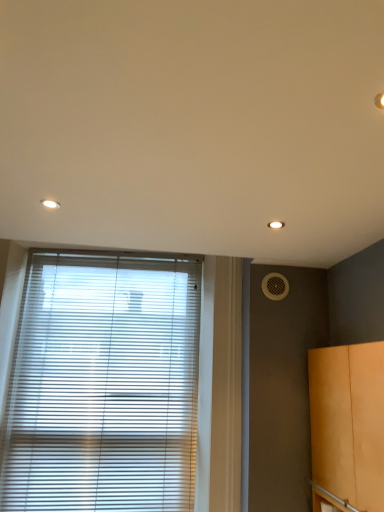
Question: Would you say matte orange cabinet at right is a long distance from white plastic blinds at lower left?

Choices:
 (A) yes
 (B) no

Answer: (B)

Question: Does matte orange cabinet at right lie behind white plastic blinds at lower left?

Choices:
 (A) yes
 (B) no

Answer: (B)

Question: From the image's perspective, is matte orange cabinet at right over white plastic blinds at lower left?

Choices:
 (A) yes
 (B) no

Answer: (B)

Question: Can you confirm if matte orange cabinet at right is bigger than white plastic blinds at lower left?

Choices:
 (A) yes
 (B) no

Answer: (A)

Question: Could you tell me if matte orange cabinet at right is facing white plastic blinds at lower left?

Choices:
 (A) yes
 (B) no

Answer: (A)

Question: From a real-world perspective, is matte orange cabinet at right physically below white plastic blinds at lower left?

Choices:
 (A) no
 (B) yes

Answer: (B)

Question: Is white mesh air conditioning at right inside white plastic blinds at lower left?

Choices:
 (A) no
 (B) yes

Answer: (A)

Question: From a real-world perspective, is white plastic blinds at lower left located beneath white mesh air conditioning at right?

Choices:
 (A) yes
 (B) no

Answer: (A)

Question: Does white plastic blinds at lower left appear on the right side of white mesh air conditioning at right?

Choices:
 (A) yes
 (B) no

Answer: (B)

Question: Considering the relative positions of white plastic blinds at lower left and white mesh air conditioning at right in the image provided, is white plastic blinds at lower left in front of white mesh air conditioning at right?

Choices:
 (A) yes
 (B) no

Answer: (A)

Question: Can you confirm if white plastic blinds at lower left is taller than white mesh air conditioning at right?

Choices:
 (A) yes
 (B) no

Answer: (A)

Question: Can you confirm if white plastic blinds at lower left is bigger than white mesh air conditioning at right?

Choices:
 (A) no
 (B) yes

Answer: (B)

Question: Is white mesh air conditioning at right placed right next to white plastic blinds at lower left?

Choices:
 (A) yes
 (B) no

Answer: (B)